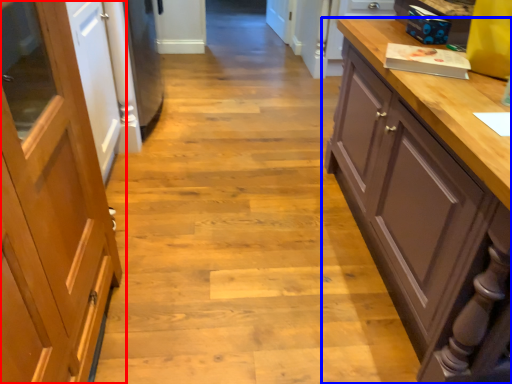
Question: Which of the following is the closest to the observer, cabinetry (highlighted by a red box) or cupboard (highlighted by a blue box)?

Choices:
 (A) cabinetry
 (B) cupboard

Answer: (A)